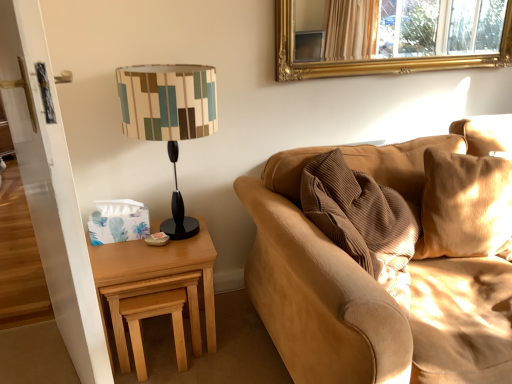
Question: Can you confirm if light brown wood at left is taller than corduroy fabric couch at right?

Choices:
 (A) yes
 (B) no

Answer: (B)

Question: Is corduroy fabric couch at right at the back of light brown wood at left?

Choices:
 (A) yes
 (B) no

Answer: (B)

Question: Does light brown wood at left come behind corduroy fabric couch at right?

Choices:
 (A) yes
 (B) no

Answer: (A)

Question: From a real-world perspective, does light brown wood at left stand above corduroy fabric couch at right?

Choices:
 (A) no
 (B) yes

Answer: (A)

Question: Can you confirm if light brown wood at left is thinner than corduroy fabric couch at right?

Choices:
 (A) no
 (B) yes

Answer: (B)

Question: From the image's perspective, is gold ornate mirror at upper center located above or below light brown wood stool at lower left?

Choices:
 (A) above
 (B) below

Answer: (A)

Question: In terms of size, does gold ornate mirror at upper center appear bigger or smaller than light brown wood stool at lower left?

Choices:
 (A) big
 (B) small

Answer: (A)

Question: Is gold ornate mirror at upper center spatially inside light brown wood stool at lower left, or outside of it?

Choices:
 (A) outside
 (B) inside

Answer: (A)

Question: Is gold ornate mirror at upper center in front of or behind light brown wood stool at lower left in the image?

Choices:
 (A) front
 (B) behind

Answer: (B)

Question: Looking at their shapes, would you say gold ornate mirror at upper center is wider or thinner than corduroy fabric couch at right?

Choices:
 (A) wide
 (B) thin

Answer: (B)

Question: From the image's perspective, is gold ornate mirror at upper center located above or below corduroy fabric couch at right?

Choices:
 (A) below
 (B) above

Answer: (B)

Question: Is gold ornate mirror at upper center bigger or smaller than corduroy fabric couch at right?

Choices:
 (A) small
 (B) big

Answer: (A)

Question: In the image, is gold ornate mirror at upper center positioned in front of or behind corduroy fabric couch at right?

Choices:
 (A) behind
 (B) front

Answer: (A)

Question: In the image, is matte black lampshade at left positioned in front of or behind light brown wood stool at lower left?

Choices:
 (A) behind
 (B) front

Answer: (B)

Question: Is point (215, 112) closer or farther from the camera than point (152, 306)?

Choices:
 (A) farther
 (B) closer

Answer: (A)